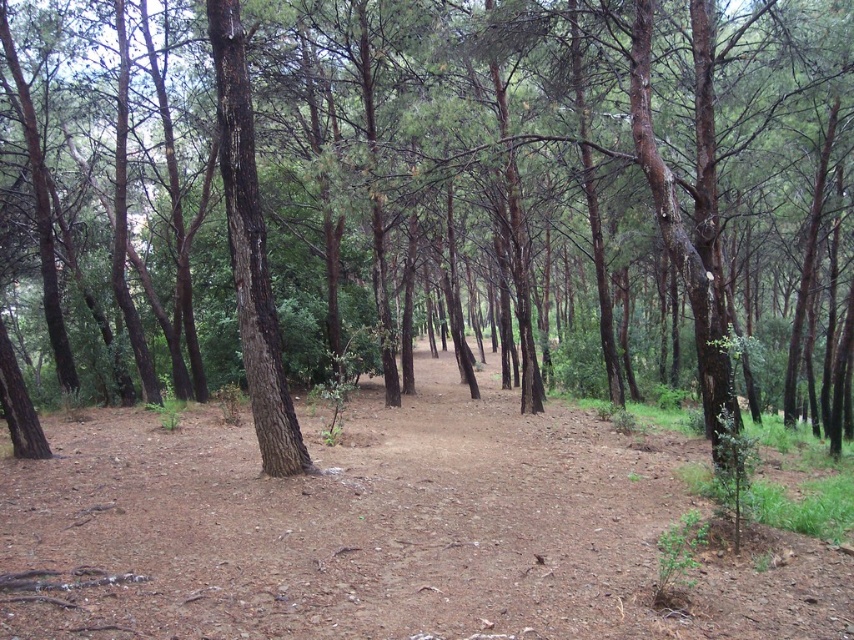
From the picture: Which is below, brown dirt track at center or dark brown bark tree at center?

Positioned lower is brown dirt track at center.

Is point (114, 586) farther from viewer compared to point (227, 16)?

That is False.

Where is `brown dirt track at center`? brown dirt track at center is located at coordinates (389, 531).